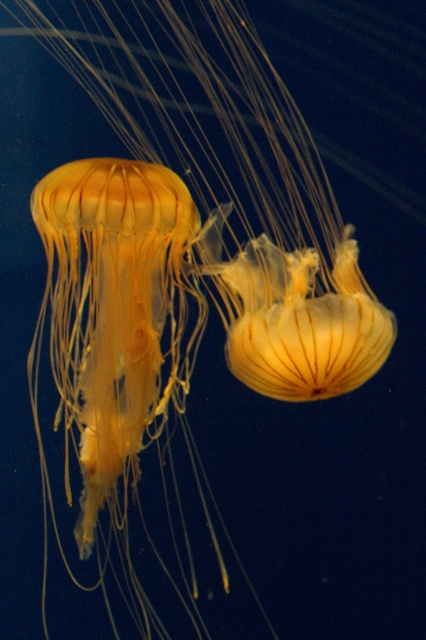
Looking at this image, who is lower down, translucent yellow jellyfish at center or translucent yellow jellyfish at left?

translucent yellow jellyfish at left is lower down.

The height and width of the screenshot is (640, 426). Describe the element at coordinates (233, 179) in the screenshot. I see `translucent yellow jellyfish at center` at that location.

Is point (46, 44) positioned in front of point (135, 230)?

No, (46, 44) is further to viewer.

Where is `translucent yellow jellyfish at center`? translucent yellow jellyfish at center is located at coordinates (233, 179).